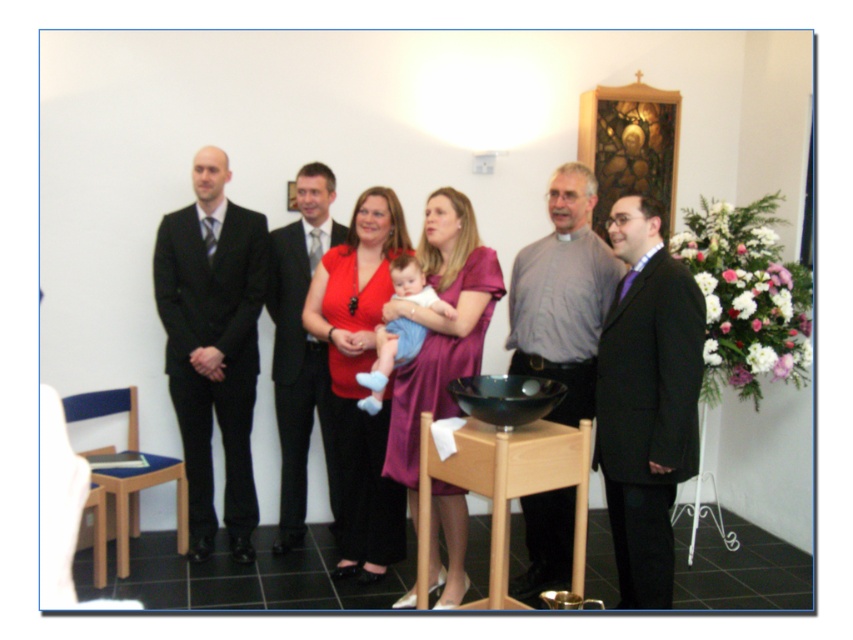
Question: In this image, where is purple satin dress at center located relative to shiny black suit at center?

Choices:
 (A) below
 (B) above

Answer: (A)

Question: Which point is closer to the camera?

Choices:
 (A) matte black suit at right
 (B) matte red dress at center

Answer: (A)

Question: Which point is farther to the camera?

Choices:
 (A) black suit at left
 (B) purple satin dress at center
 (C) matte black suit at center
 (D) shiny black suit at center

Answer: (D)

Question: Which object is positioned closest to the black suit at left?

Choices:
 (A) matte black suit at right
 (B) light blue fabric baby at center

Answer: (B)

Question: Can you confirm if matte black suit at center is positioned to the right of light blue fabric baby at center?

Choices:
 (A) no
 (B) yes

Answer: (A)

Question: Does matte black suit at center lie behind shiny black suit at center?

Choices:
 (A) no
 (B) yes

Answer: (A)